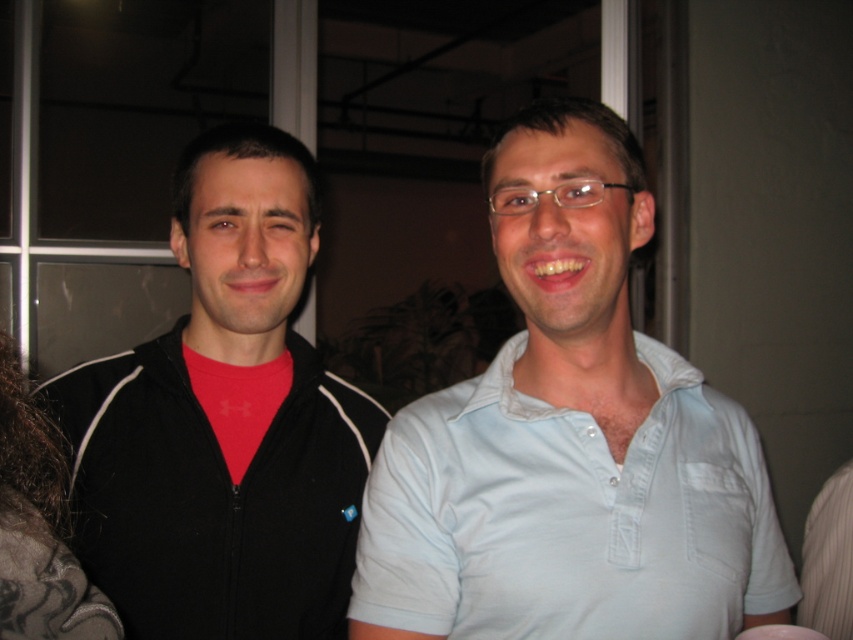
Is black matte jacket at left above dark brown hair at left?

Indeed, black matte jacket at left is positioned over dark brown hair at left.

Does black matte jacket at left appear on the right side of dark brown hair at left?

Indeed, black matte jacket at left is positioned on the right side of dark brown hair at left.

Does point (209, 572) lie behind point (7, 433)?

Yes, it is behind point (7, 433).

Find the location of a particular element. The width and height of the screenshot is (853, 640). black matte jacket at left is located at coordinates (224, 420).

Is point (178, 481) positioned after point (672, 368)?

Yes.

Which of these two, black matte jacket at left or light blue cotton polo shirt at center, stands shorter?

light blue cotton polo shirt at center

Image resolution: width=853 pixels, height=640 pixels. Describe the element at coordinates (224, 420) in the screenshot. I see `black matte jacket at left` at that location.

The width and height of the screenshot is (853, 640). What are the coordinates of `black matte jacket at left` in the screenshot? It's located at (224, 420).

Which is below, light blue cotton polo shirt at center or dark brown hair at left?

light blue cotton polo shirt at center

Does light blue cotton polo shirt at center have a lesser height compared to dark brown hair at left?

No, light blue cotton polo shirt at center is not shorter than dark brown hair at left.

Does point (543, 554) lie behind point (41, 614)?

Yes, point (543, 554) is farther from viewer.

You are a GUI agent. You are given a task and a screenshot of the screen. Output one action in this format:
    pyautogui.click(x=<x>, y=<y>)
    Task: Click on the light blue cotton polo shirt at center
    The height and width of the screenshot is (640, 853).
    Given the screenshot: What is the action you would take?
    pyautogui.click(x=569, y=515)